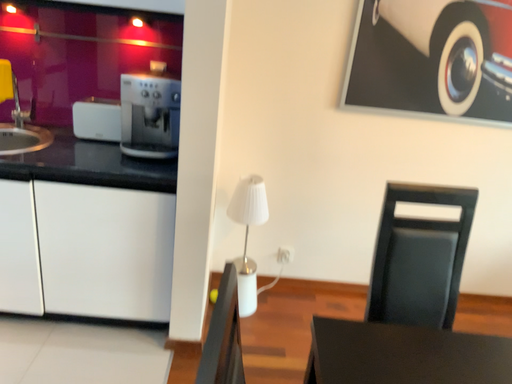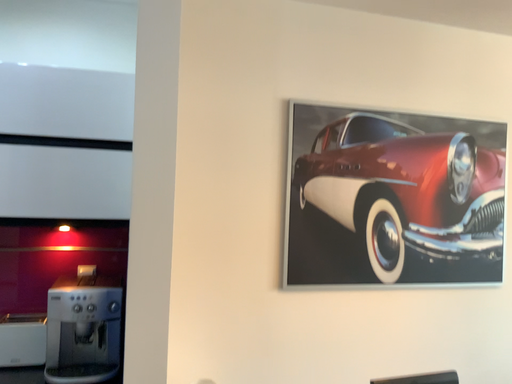
Question: Which way did the camera rotate in the video?

Choices:
 (A) rotated downward
 (B) rotated upward

Answer: (B)